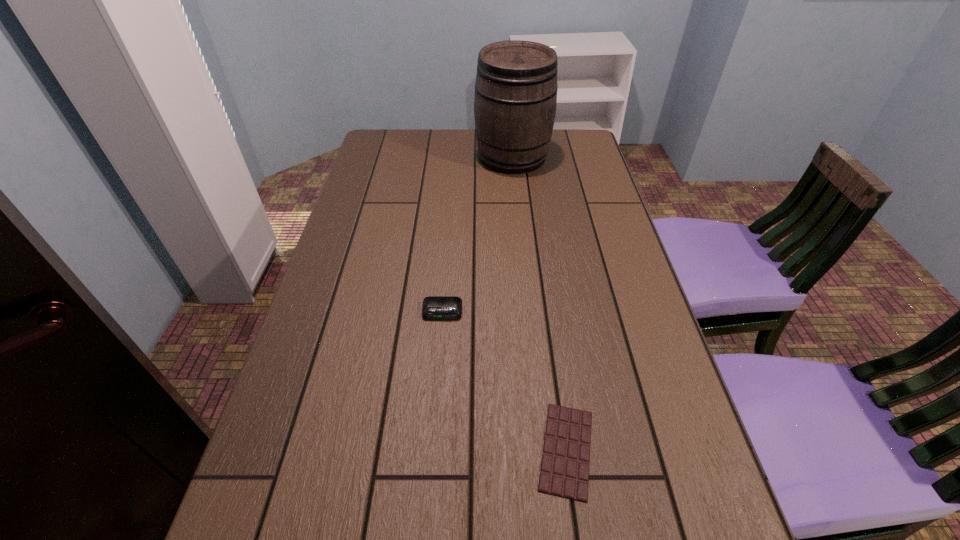
Image resolution: width=960 pixels, height=540 pixels. Find the location of `object at the right edge`. object at the right edge is located at coordinates (515, 99).

Find the location of a particular element. The image size is (960, 540). object that is at the far right corner is located at coordinates (515, 99).

Find the location of a particular element. vacant space at the far edge of the desktop is located at coordinates (432, 132).

Locate an element on the screen. Image resolution: width=960 pixels, height=540 pixels. free space at the left edge of the desktop is located at coordinates (347, 404).

In the image, there is a desktop. Where is `vacant space at the right edge`? Image resolution: width=960 pixels, height=540 pixels. vacant space at the right edge is located at coordinates (593, 204).

In the image, there is a desktop. Identify the location of vacant space at the far left corner. Image resolution: width=960 pixels, height=540 pixels. (373, 146).

Identify the location of free region at the far right corner. (589, 145).

Locate an element on the screen. Image resolution: width=960 pixels, height=540 pixels. free space between the second farthest object and the nearest object is located at coordinates (504, 381).

Locate an element on the screen. The image size is (960, 540). empty space that is in between the wine bucket and the alarm clock is located at coordinates (477, 234).

In order to click on unoccupied area between the second farthest object and the shortest object in this screenshot , I will do `click(504, 381)`.